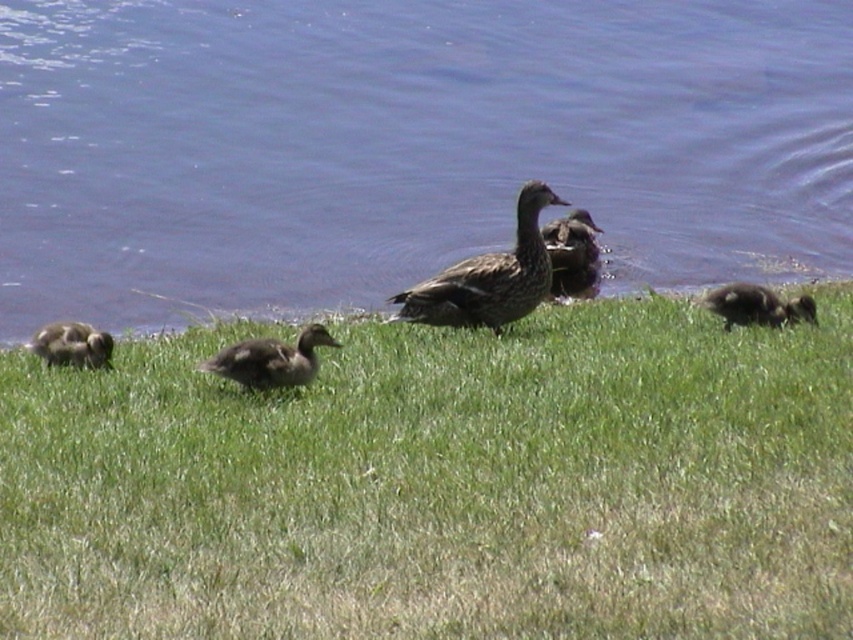
Measure the distance between point (x=595, y=260) and camera.

Point (x=595, y=260) and camera are 11.18 meters apart from each other.

Based on the photo, between brown matte duckling at center and brown fuzzy duckling at lower left, which one has less height?

brown fuzzy duckling at lower left is shorter.

Between point (554, 266) and point (83, 332), which one is positioned in front?

Point (83, 332) is in front.

Identify the location of brown matte duckling at center. (572, 252).

Is point (229, 356) positioned behind point (68, 324)?

That is False.

Does brown fuzzy duckling at center lie in front of brown fuzzy duckling at lower left?

Yes.

Which is in front, point (329, 344) or point (59, 349)?

Point (329, 344) is in front.

Locate an element on the screen. This screenshot has height=640, width=853. brown fuzzy duckling at center is located at coordinates (271, 358).

Can you confirm if brown fuzzy duckling at center is shorter than brown matte duckling at center?

Yes.

Does brown fuzzy duckling at center appear under brown matte duckling at center?

Indeed, brown fuzzy duckling at center is positioned under brown matte duckling at center.

Which is in front, point (288, 346) or point (578, 276)?

Point (288, 346) is more forward.

I want to click on brown fuzzy duckling at center, so click(271, 358).